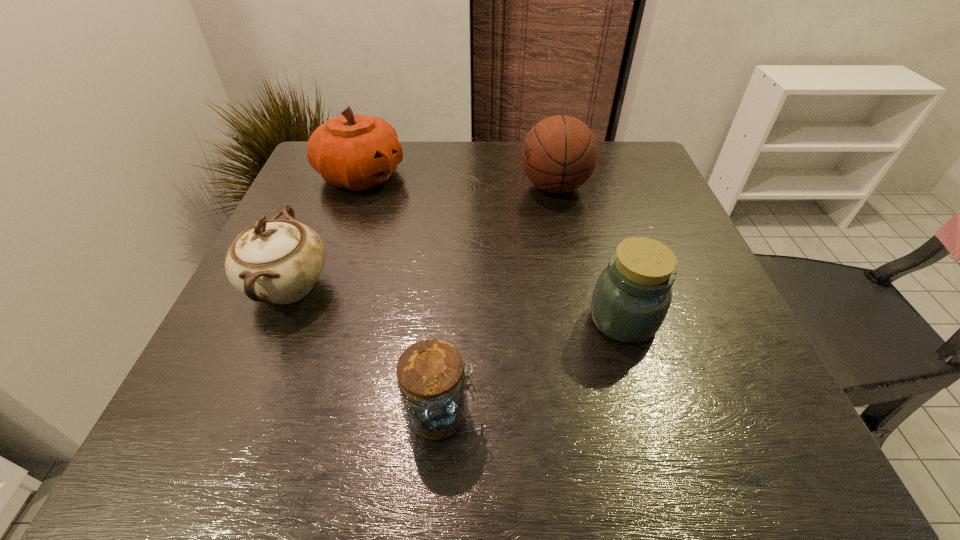
Find the location of a particular element. pumpkin is located at coordinates (353, 151).

What are the coordinates of `basketball` in the screenshot? It's located at (559, 154).

The width and height of the screenshot is (960, 540). Identify the location of chinaware. tap(278, 261).

This screenshot has height=540, width=960. I want to click on the right jar, so click(632, 296).

Find the location of a particular element. the farther jar is located at coordinates (632, 296).

The image size is (960, 540). In order to click on the left jar in this screenshot , I will do `click(432, 383)`.

The height and width of the screenshot is (540, 960). I want to click on the shorter jar, so click(x=432, y=383).

Where is `free space located 0.080m on the front-facing side of the pumpkin`? The height and width of the screenshot is (540, 960). free space located 0.080m on the front-facing side of the pumpkin is located at coordinates (437, 176).

Identify the location of free space located on the side with brand label of the basketball. This screenshot has width=960, height=540. (475, 187).

The width and height of the screenshot is (960, 540). In order to click on vacant space located on the side with brand label of the basketball in this screenshot , I will do `click(487, 187)`.